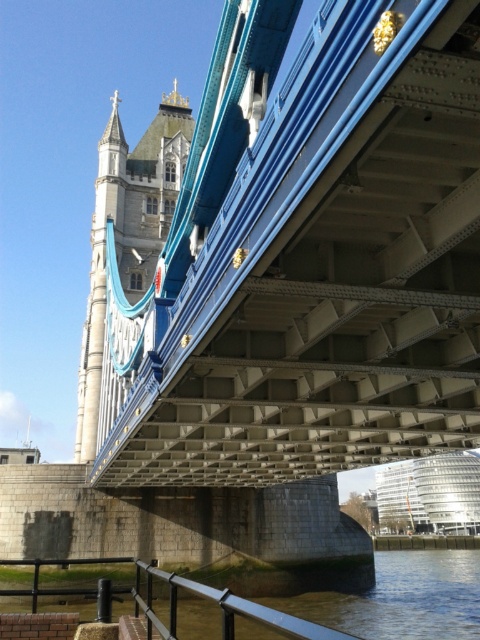
Question: Among these objects, which one is nearest to the camera?

Choices:
 (A) stone tower at upper left
 (B) metallic blue suspension bridge at center

Answer: (B)

Question: Does metallic blue suspension bridge at center appear over stone tower at upper left?

Choices:
 (A) no
 (B) yes

Answer: (A)

Question: Which object is closer to the camera taking this photo?

Choices:
 (A) stone tower at upper left
 (B) metallic blue suspension bridge at center

Answer: (B)

Question: Is metallic blue suspension bridge at center above stone tower at upper left?

Choices:
 (A) no
 (B) yes

Answer: (A)

Question: Is metallic blue suspension bridge at center thinner than stone tower at upper left?

Choices:
 (A) no
 (B) yes

Answer: (A)